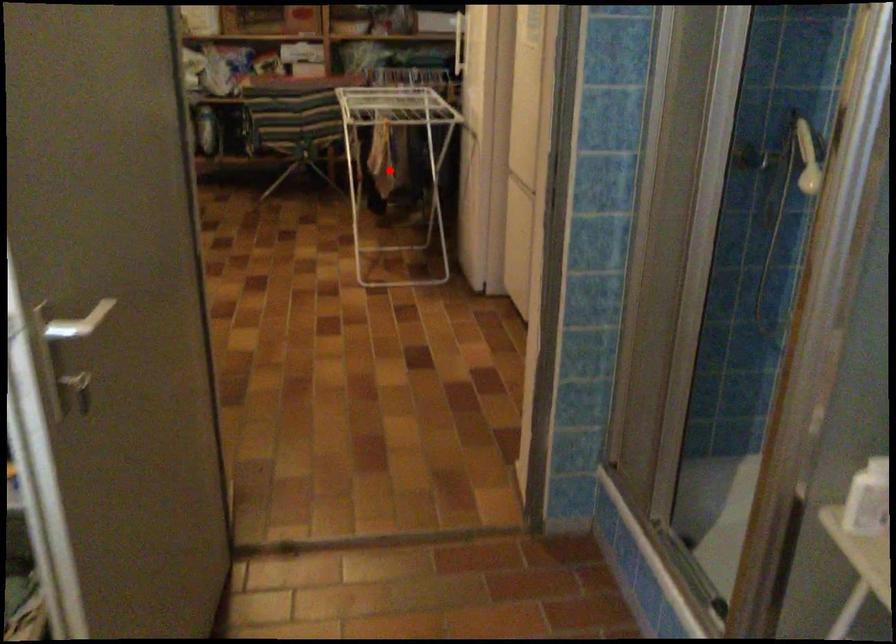
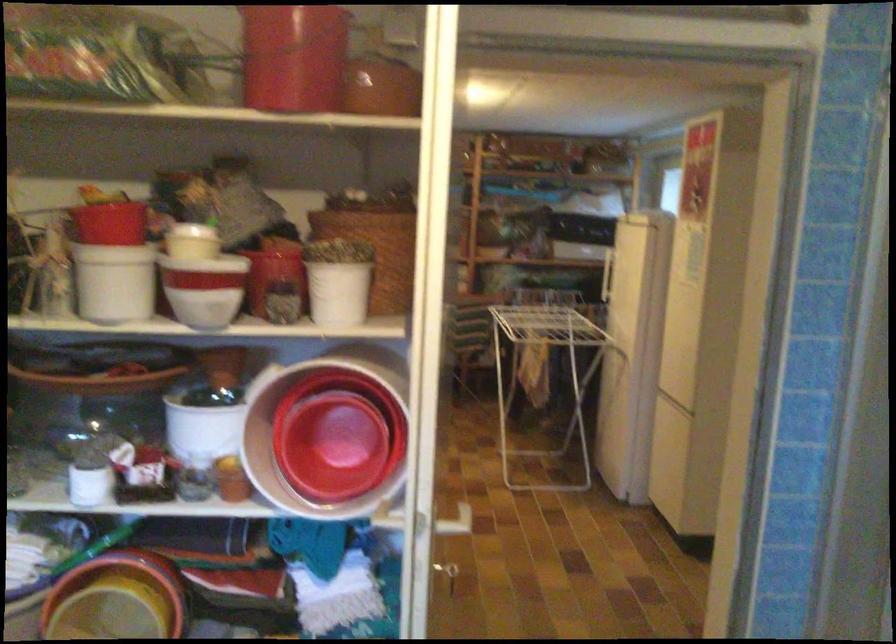
The point at the highlighted location is marked in the first image. Where is the corresponding point in the second image?

(545, 375)